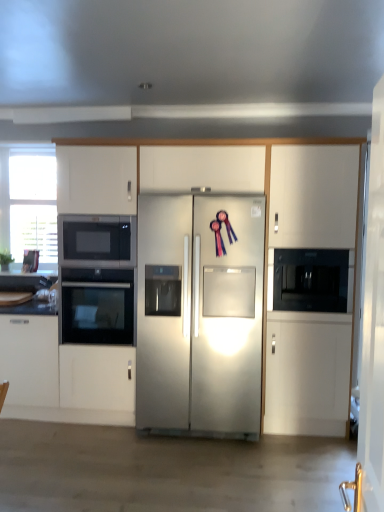
Question: Can you confirm if white glossy countertop at lower left is shorter than black glass oven at left, the 1th oven from the top?

Choices:
 (A) yes
 (B) no

Answer: (A)

Question: Does white glossy countertop at lower left have a lesser width compared to black glass oven at left, which is counted as the 2th oven, starting from the bottom?

Choices:
 (A) no
 (B) yes

Answer: (A)

Question: Does white glossy countertop at lower left lie behind black glass oven at left, the 1th oven from the top?

Choices:
 (A) yes
 (B) no

Answer: (A)

Question: Is black glass oven at left, which is counted as the 2th oven, starting from the bottom, located within white glossy countertop at lower left?

Choices:
 (A) yes
 (B) no

Answer: (B)

Question: Considering the relative sizes of white glossy countertop at lower left and black glass oven at left, which is counted as the 2th oven, starting from the bottom, in the image provided, is white glossy countertop at lower left smaller than black glass oven at left, which is counted as the 2th oven, starting from the bottom,?

Choices:
 (A) no
 (B) yes

Answer: (B)

Question: In the image, is black glass oven at left, marked as the first oven in a bottom-to-top arrangement, on the left side or the right side of black glass oven at left, which is counted as the 2th oven, starting from the bottom?

Choices:
 (A) right
 (B) left

Answer: (B)

Question: In terms of width, does black glass oven at left, marked as the first oven in a bottom-to-top arrangement, look wider or thinner when compared to black glass oven at left, which is counted as the 2th oven, starting from the bottom?

Choices:
 (A) thin
 (B) wide

Answer: (B)

Question: Is black glass oven at left, marked as the first oven in a bottom-to-top arrangement, spatially inside black glass oven at left, which is counted as the 2th oven, starting from the bottom, or outside of it?

Choices:
 (A) inside
 (B) outside

Answer: (B)

Question: From the image's perspective, relative to black glass oven at left, which is counted as the 2th oven, starting from the bottom, is black glass oven at left, marked as the first oven in a bottom-to-top arrangement, above or below?

Choices:
 (A) below
 (B) above

Answer: (A)

Question: Considering the positions of black matte microwave oven at right and black glass oven at left, the 1th oven from the top, in the image, is black matte microwave oven at right taller or shorter than black glass oven at left, the 1th oven from the top,?

Choices:
 (A) tall
 (B) short

Answer: (A)

Question: Would you say black matte microwave oven at right is to the left or to the right of black glass oven at left, the 1th oven from the top, in the picture?

Choices:
 (A) left
 (B) right

Answer: (B)

Question: Based on their sizes in the image, would you say black matte microwave oven at right is bigger or smaller than black glass oven at left, which is counted as the 2th oven, starting from the bottom?

Choices:
 (A) small
 (B) big

Answer: (A)

Question: Is point (342, 311) closer or farther from the camera than point (100, 245)?

Choices:
 (A) closer
 (B) farther

Answer: (A)

Question: Is black glass oven at left, which is counted as the 2th oven, starting from the bottom, wider or thinner than black glass oven at left, marked as the first oven in a bottom-to-top arrangement?

Choices:
 (A) wide
 (B) thin

Answer: (B)

Question: Considering their positions, is black glass oven at left, which is counted as the 2th oven, starting from the bottom, located in front of or behind black glass oven at left, acting as the second oven starting from the top?

Choices:
 (A) front
 (B) behind

Answer: (A)